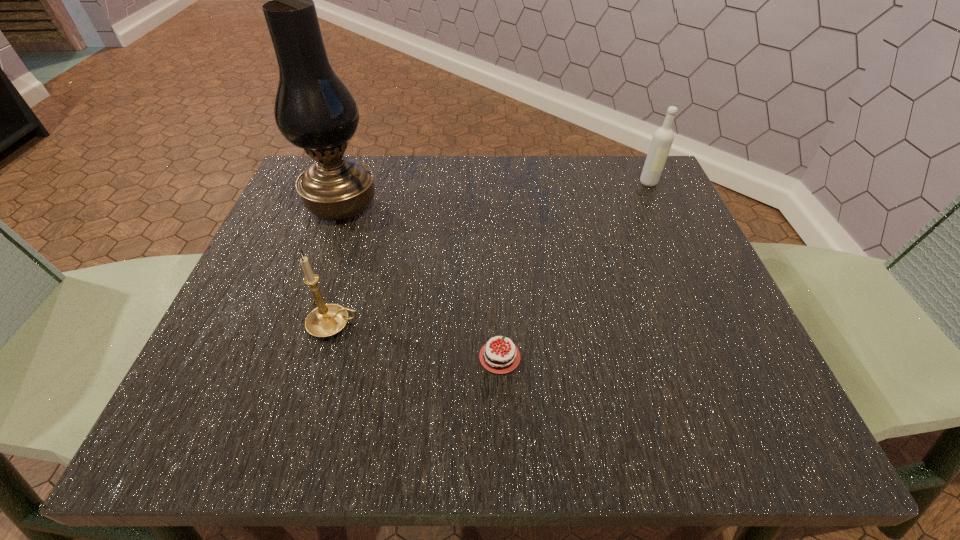
Image resolution: width=960 pixels, height=540 pixels. In the image, there is a desktop. Find the location of `free space at the right edge`. free space at the right edge is located at coordinates (736, 325).

At what (x,y) coordinates should I click in order to perform the action: click on free region at the far left corner of the desktop. Please return your answer as a coordinate pair (x, y). The image size is (960, 540). Looking at the image, I should click on (291, 204).

The image size is (960, 540). Identify the location of free space between the tallest object and the chocolate cake. (420, 281).

Find the location of a particular element. free spot between the oil lamp and the candle holder is located at coordinates (338, 265).

Locate an element on the screen. free space between the rightmost object and the chocolate cake is located at coordinates (574, 270).

Where is `free space between the candle holder and the oil lamp`? free space between the candle holder and the oil lamp is located at coordinates coord(338,265).

This screenshot has width=960, height=540. Identify the location of unoccupied area between the oil lamp and the third object from left to right. (420, 281).

This screenshot has height=540, width=960. Find the location of `free space between the second object from right to left and the oil lamp`. free space between the second object from right to left and the oil lamp is located at coordinates (420, 281).

I want to click on vacant space that's between the candle holder and the chocolate cake, so click(x=417, y=341).

In order to click on vacant area that lies between the shortest object and the rightmost object in this screenshot , I will do `click(574, 270)`.